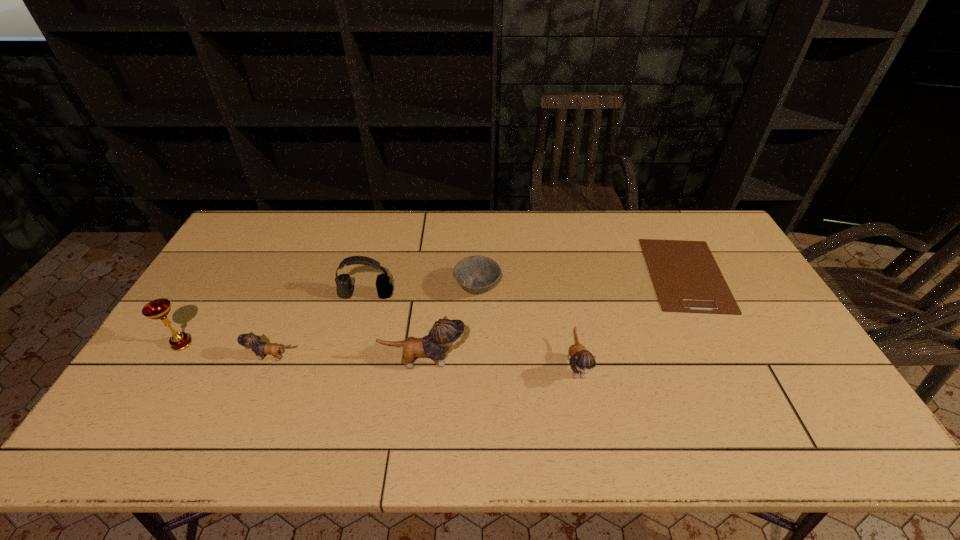
Locate an element on the screen. free space between the leftmost object and the second object from left to right is located at coordinates (228, 350).

What are the coordinates of `empty location between the second kitten from left to right and the chalice` in the screenshot? It's located at (302, 353).

The height and width of the screenshot is (540, 960). I want to click on vacant area between the headset and the chalice, so click(274, 319).

Where is `empty space between the bowl and the shortest object`? Image resolution: width=960 pixels, height=540 pixels. empty space between the bowl and the shortest object is located at coordinates (582, 281).

Where is `vacant space in between the second kitten from right to left and the headset`? The width and height of the screenshot is (960, 540). vacant space in between the second kitten from right to left and the headset is located at coordinates (395, 328).

The width and height of the screenshot is (960, 540). In order to click on vacant space in between the clipboard and the shortest kitten in this screenshot , I will do `click(479, 315)`.

The height and width of the screenshot is (540, 960). In order to click on the closest object to the sixth tallest object in this screenshot , I will do `click(445, 333)`.

Locate which object is the third closest to the fifth object from right to left. Please provide its 2D coordinates. Your answer should be formatted as a tuple, i.e. [(x, y)], where the tuple contains the x and y coordinates of a point satisfying the conditions above.

[(251, 341)]

Choose which kitten is the nearest neighbor to the second kitten from right to left. Please provide its 2D coordinates. Your answer should be formatted as a tuple, i.e. [(x, y)], where the tuple contains the x and y coordinates of a point satisfying the conditions above.

[(251, 341)]

Locate which kitten ranks second in proximity to the fourth tallest object. Please provide its 2D coordinates. Your answer should be formatted as a tuple, i.e. [(x, y)], where the tuple contains the x and y coordinates of a point satisfying the conditions above.

[(251, 341)]